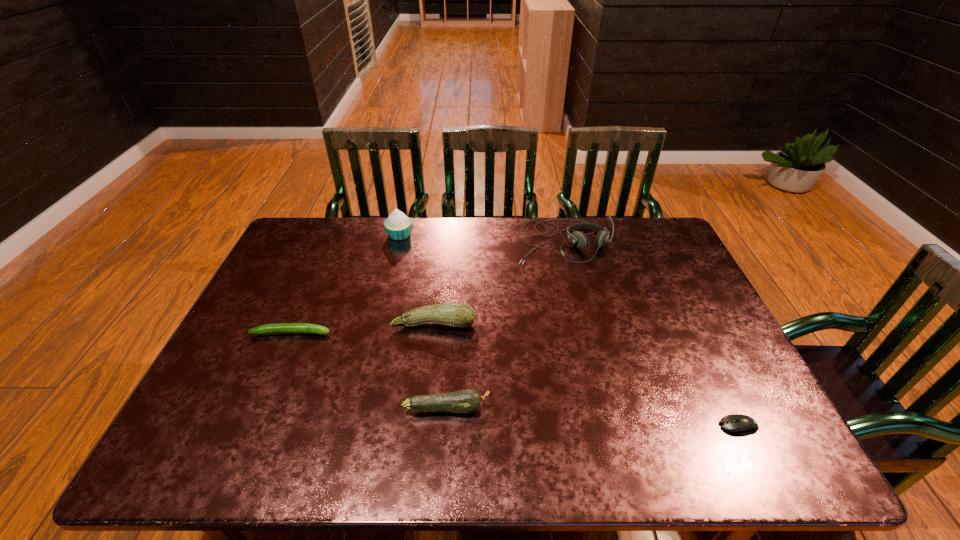
The width and height of the screenshot is (960, 540). Find the location of `object positioned at the near edge`. object positioned at the near edge is located at coordinates (740, 424).

This screenshot has width=960, height=540. In order to click on object that is at the left edge in this screenshot , I will do `click(279, 328)`.

Locate an element on the screen. object located in the right edge section of the desktop is located at coordinates (740, 424).

Find the location of a particular element. This screenshot has height=540, width=960. object present at the near right corner is located at coordinates (740, 424).

Find the location of `free space at the far edge of the desktop`. free space at the far edge of the desktop is located at coordinates (387, 232).

In the image, there is a desktop. Identify the location of vacant space at the near edge. (519, 441).

Identify the location of free space at the right edge of the desktop. (x=686, y=323).

Locate an element on the screen. The image size is (960, 540). blank space at the near left corner is located at coordinates (247, 443).

In the image, there is a desktop. Identify the location of vacant space at the far right corner. (622, 222).

Where is `free spot between the tallest object and the rightmost object`? Image resolution: width=960 pixels, height=540 pixels. free spot between the tallest object and the rightmost object is located at coordinates (569, 330).